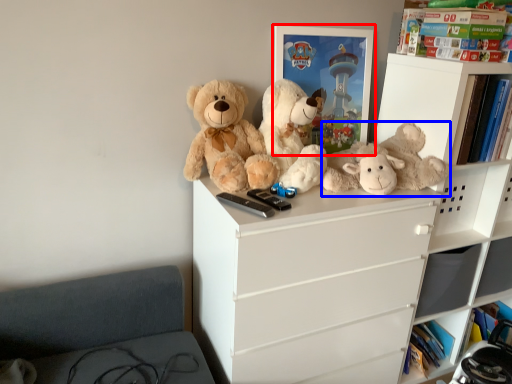
Question: Among these objects, which one is nearest to the camera, picture frame (highlighted by a red box) or teddy bear (highlighted by a blue box)?

Choices:
 (A) picture frame
 (B) teddy bear

Answer: (B)